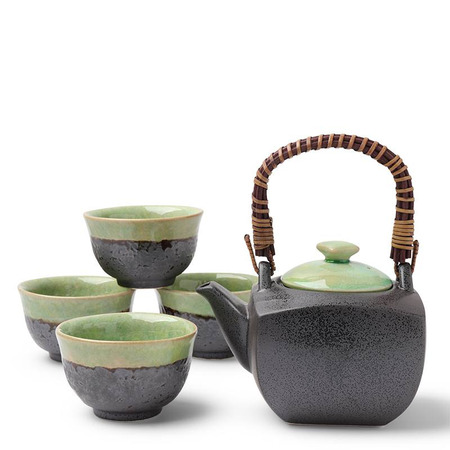
Identify the location of brown handle. The height and width of the screenshot is (450, 450). point(262,194).